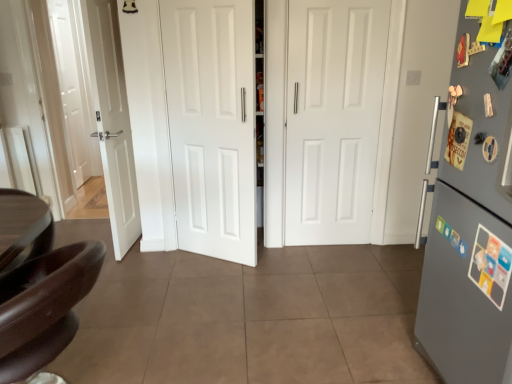
Describe the element at coordinates (472, 230) in the screenshot. I see `gray matte refrigerator at right` at that location.

What are the coordinates of `shiny brown leather chair at lower left` in the screenshot? It's located at (44, 307).

What is the approximate height of white matte door at center, positioned as the first door in right-to-left order?

white matte door at center, positioned as the first door in right-to-left order, is 1.62 meters in height.

Where is `gray matte refrigerator at right`? The width and height of the screenshot is (512, 384). gray matte refrigerator at right is located at coordinates (472, 230).

Locate an element on the screen. refrigerator above the shiny brown leather chair at lower left (from the image's perspective) is located at coordinates (472, 230).

Is gray matte refrigerator at right beside shiny brown leather chair at lower left?

gray matte refrigerator at right and shiny brown leather chair at lower left are clearly separated.

From the image's perspective, between gray matte refrigerator at right and shiny brown leather chair at lower left, who is located below?

shiny brown leather chair at lower left, from the image's perspective.

Looking at this image, does gray matte refrigerator at right have a lesser height compared to shiny brown leather chair at lower left?

Incorrect, the height of gray matte refrigerator at right does not fall short of that of shiny brown leather chair at lower left.

Who is taller, white matte door at center, the second door viewed from the left, or gray matte refrigerator at right?

white matte door at center, the second door viewed from the left.

Does white matte door at center, positioned as the first door in right-to-left order, turn towards gray matte refrigerator at right?

Yes, white matte door at center, positioned as the first door in right-to-left order, is oriented towards gray matte refrigerator at right.

Considering the positions of objects white matte door at center, the second door viewed from the left, and gray matte refrigerator at right in the image provided, who is more to the right, white matte door at center, the second door viewed from the left, or gray matte refrigerator at right?

Positioned to the right is gray matte refrigerator at right.

Considering the relative sizes of white matte door at center, the second door viewed from the left, and gray matte refrigerator at right in the image provided, is white matte door at center, the second door viewed from the left, smaller than gray matte refrigerator at right?

Indeed, white matte door at center, the second door viewed from the left, has a smaller size compared to gray matte refrigerator at right.

Does point (72, 311) come in front of point (169, 117)?

Yes, it is.

In the image, is shiny brown leather chair at lower left positioned in front of or behind white matte door at center, which is counted as the 1th door, starting from the left?

shiny brown leather chair at lower left is in front of white matte door at center, which is counted as the 1th door, starting from the left.

Locate an element on the screen. chair in front of the white matte door at center, the second door viewed from the right is located at coordinates (x=44, y=307).

Can you confirm if shiny brown leather chair at lower left is thinner than white matte door at center, which is counted as the 1th door, starting from the left?

Incorrect, the width of shiny brown leather chair at lower left is not less than that of white matte door at center, which is counted as the 1th door, starting from the left.

From the image's perspective, is white matte door at center, the second door viewed from the right, positioned above or below shiny brown leather chair at lower left?

From the image's perspective, white matte door at center, the second door viewed from the right, appears above shiny brown leather chair at lower left.

Between white matte door at center, which is counted as the 1th door, starting from the left, and shiny brown leather chair at lower left, which one has smaller size?

white matte door at center, which is counted as the 1th door, starting from the left, is smaller.

Do you think white matte door at center, the second door viewed from the right, is within shiny brown leather chair at lower left, or outside of it?

white matte door at center, the second door viewed from the right, is located beyond the bounds of shiny brown leather chair at lower left.

Can you confirm if white matte door at center, the second door viewed from the right, is positioned to the right of shiny brown leather chair at lower left?

Correct, you'll find white matte door at center, the second door viewed from the right, to the right of shiny brown leather chair at lower left.

From a real-world perspective, between white matte door at center, the second door viewed from the left, and white matte door at center, which is counted as the 1th door, starting from the left, who is vertically higher?

From a 3D spatial view, white matte door at center, which is counted as the 1th door, starting from the left, is above.

Which object is thinner, white matte door at center, the second door viewed from the left, or white matte door at center, which is counted as the 1th door, starting from the left?

With smaller width is white matte door at center, which is counted as the 1th door, starting from the left.

Which point is more forward, (313, 55) or (194, 98)?

Positioned in front is point (194, 98).

Considering the relative positions of white matte door at center, the second door viewed from the left, and white matte door at center, which is counted as the 1th door, starting from the left, in the image provided, is white matte door at center, the second door viewed from the left, to the right of white matte door at center, which is counted as the 1th door, starting from the left, from the viewer's perspective?

Correct, you'll find white matte door at center, the second door viewed from the left, to the right of white matte door at center, which is counted as the 1th door, starting from the left.

Is gray matte refrigerator at right at the back of shiny brown leather chair at lower left?

Yes.

Is point (94, 269) positioned after point (460, 333)?

That is False.

Looking at their sizes, would you say shiny brown leather chair at lower left is wider or thinner than gray matte refrigerator at right?

Clearly, shiny brown leather chair at lower left has less width compared to gray matte refrigerator at right.

This screenshot has height=384, width=512. Find the location of `chair on the left of gray matte refrigerator at right`. chair on the left of gray matte refrigerator at right is located at coordinates (44, 307).

From a real-world perspective, who is located higher, gray matte refrigerator at right or white matte door at center, the second door viewed from the left?

white matte door at center, the second door viewed from the left, from a real-world perspective.

Is gray matte refrigerator at right far away from white matte door at center, the second door viewed from the left?

Absolutely, gray matte refrigerator at right is distant from white matte door at center, the second door viewed from the left.

From the image's perspective, is gray matte refrigerator at right above or below white matte door at center, the second door viewed from the left?

From the image's perspective, gray matte refrigerator at right appears below white matte door at center, the second door viewed from the left.

Is gray matte refrigerator at right taller or shorter than white matte door at center, the second door viewed from the left?

Clearly, gray matte refrigerator at right is shorter compared to white matte door at center, the second door viewed from the left.

The height and width of the screenshot is (384, 512). I want to click on refrigerator that is behind the shiny brown leather chair at lower left, so click(x=472, y=230).

Locate an element on the screen. refrigerator below the white matte door at center, positioned as the first door in right-to-left order (from a real-world perspective) is located at coordinates click(472, 230).

Considering their positions, is shiny brown leather chair at lower left positioned closer to white matte door at center, the second door viewed from the left, than gray matte refrigerator at right?

Among the two, gray matte refrigerator at right is located nearer to white matte door at center, the second door viewed from the left.

From the image, which object appears to be nearer to shiny brown leather chair at lower left, white matte door at center, positioned as the first door in right-to-left order, or gray matte refrigerator at right?

Based on the image, gray matte refrigerator at right appears to be nearer to shiny brown leather chair at lower left.

Considering their positions, is gray matte refrigerator at right positioned closer to white matte door at center, which is counted as the 1th door, starting from the left, than white matte door at center, the second door viewed from the left?

white matte door at center, the second door viewed from the left.

Based on their spatial positions, is shiny brown leather chair at lower left or white matte door at center, the second door viewed from the left, closer to gray matte refrigerator at right?

shiny brown leather chair at lower left lies closer to gray matte refrigerator at right than the other object.

Looking at the image, which one is located closer to shiny brown leather chair at lower left, white matte door at center, positioned as the first door in right-to-left order, or white matte door at center, which is counted as the 1th door, starting from the left?

white matte door at center, which is counted as the 1th door, starting from the left, is positioned closer to the anchor shiny brown leather chair at lower left.

When comparing their distances from white matte door at center, which is counted as the 1th door, starting from the left, does white matte door at center, positioned as the first door in right-to-left order, or gray matte refrigerator at right seem further?

gray matte refrigerator at right is further to white matte door at center, which is counted as the 1th door, starting from the left.

From the image, which object appears to be farther from gray matte refrigerator at right, white matte door at center, positioned as the first door in right-to-left order, or white matte door at center, which is counted as the 1th door, starting from the left?

white matte door at center, which is counted as the 1th door, starting from the left, is positioned further to the anchor gray matte refrigerator at right.

Looking at the image, which one is located further to shiny brown leather chair at lower left, gray matte refrigerator at right or white matte door at center, positioned as the first door in right-to-left order?

white matte door at center, positioned as the first door in right-to-left order, lies further to shiny brown leather chair at lower left than the other object.

Identify the location of door positioned between gray matte refrigerator at right and white matte door at center, positioned as the first door in right-to-left order, from near to far. (212, 124).

In order to click on refrigerator between shiny brown leather chair at lower left and white matte door at center, positioned as the first door in right-to-left order, in the front-back direction in this screenshot , I will do `click(472, 230)`.

Image resolution: width=512 pixels, height=384 pixels. In order to click on door between shiny brown leather chair at lower left and white matte door at center, positioned as the first door in right-to-left order, in the front-back direction in this screenshot , I will do pos(212,124).